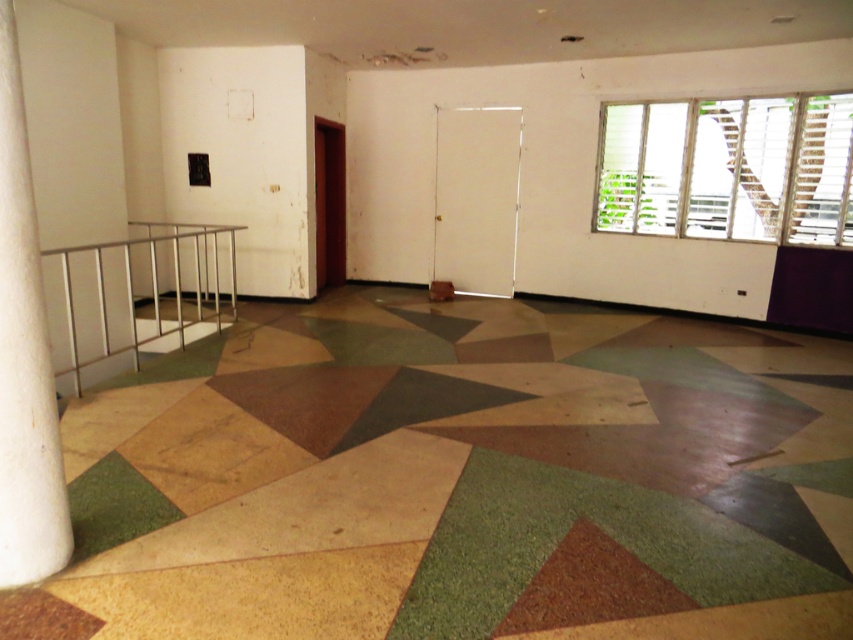
In the scene shown: Is white marble pillar at left bigger than silver metallic balustrade at left?

No.

The width and height of the screenshot is (853, 640). What are the coordinates of `white marble pillar at left` in the screenshot? It's located at point(24,356).